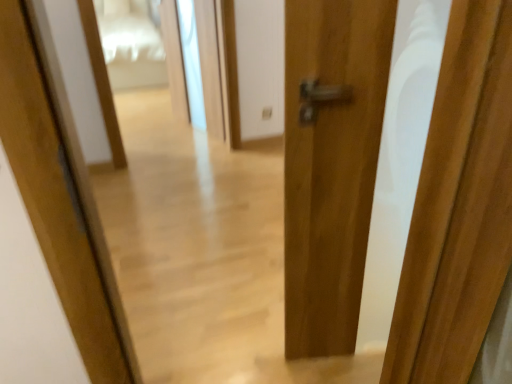
Locate an element on the screen. This screenshot has height=384, width=512. vacant region under matte wood door at center (from a real-world perspective) is located at coordinates (334, 354).